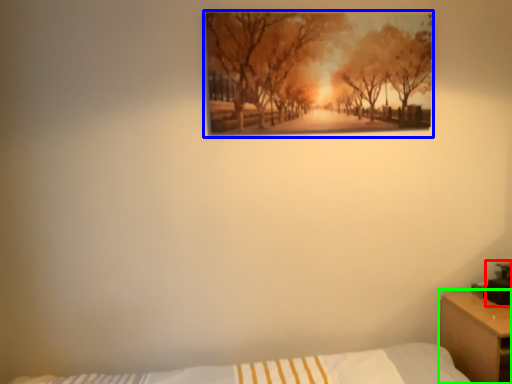
Question: Which object is the closest to the table lamp (highlighted by a red box)? Choose among these: picture frame (highlighted by a blue box) or nightstand (highlighted by a green box).

Choices:
 (A) picture frame
 (B) nightstand

Answer: (B)